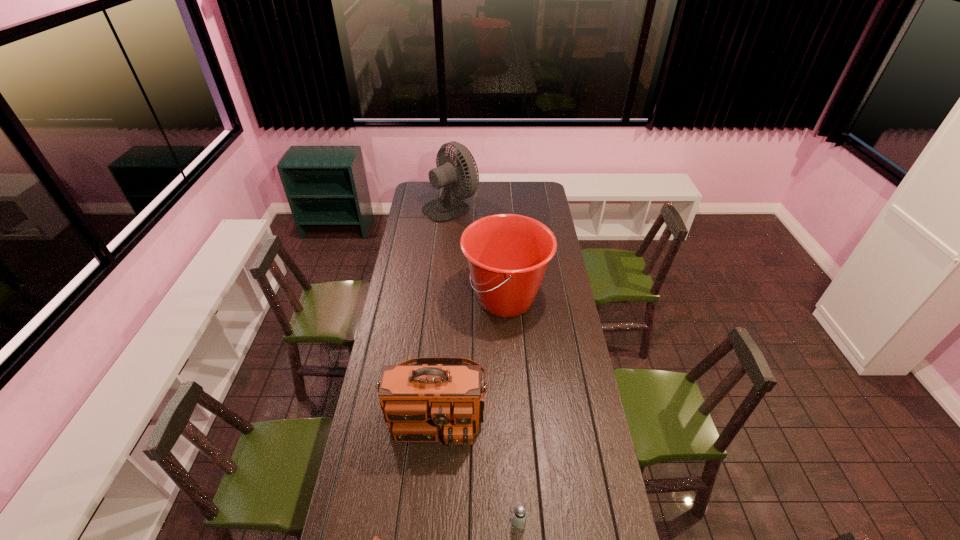
In order to click on the farthest object in this screenshot , I will do `click(446, 208)`.

The width and height of the screenshot is (960, 540). Identify the location of the second farthest object. (507, 254).

Where is `the third farthest object`? This screenshot has height=540, width=960. the third farthest object is located at coordinates (419, 402).

Find the location of a particular element. saltshaker is located at coordinates (519, 517).

The image size is (960, 540). Find the location of `the fourth tallest object`. the fourth tallest object is located at coordinates (519, 517).

You are a GUI agent. You are given a task and a screenshot of the screen. Output one action in this format:
    pyautogui.click(x=<x>, y=<y>)
    Task: Click on the vacant area situated in front of the fan to direct airflow
    The height and width of the screenshot is (540, 960).
    Given the screenshot: What is the action you would take?
    click(x=516, y=206)

I want to click on vacant position located 0.240m with the handle attached to the rim of the bucket, so click(414, 299).

The height and width of the screenshot is (540, 960). Find the location of `vacant space situated with the handle attached to the rim of the bucket`. vacant space situated with the handle attached to the rim of the bucket is located at coordinates (400, 299).

The image size is (960, 540). What are the coordinates of `free spot located with the handle attached to the rim of the bucket` in the screenshot? It's located at (412, 299).

Locate an element on the screen. vacant space located 0.230m on the face side of the third nearest object is located at coordinates (428, 518).